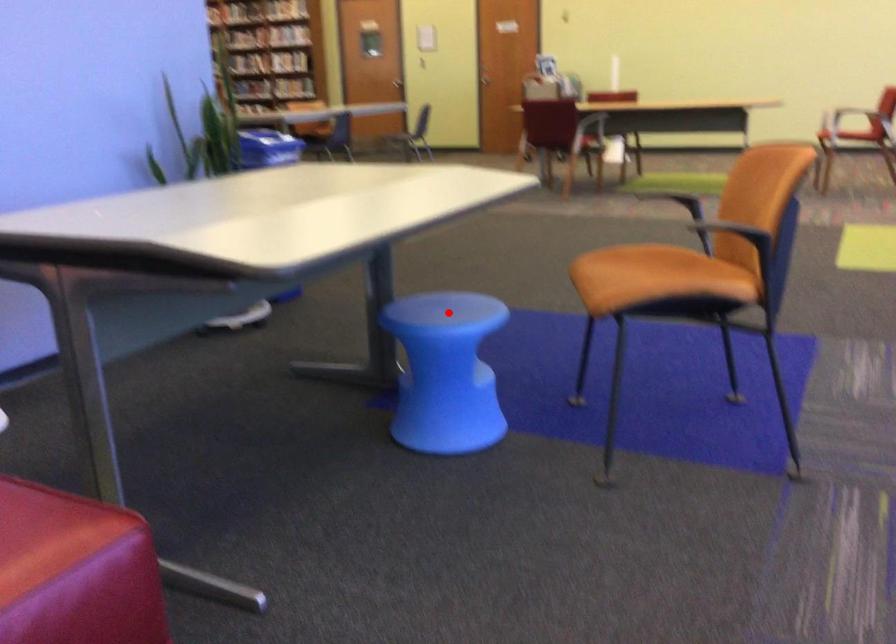
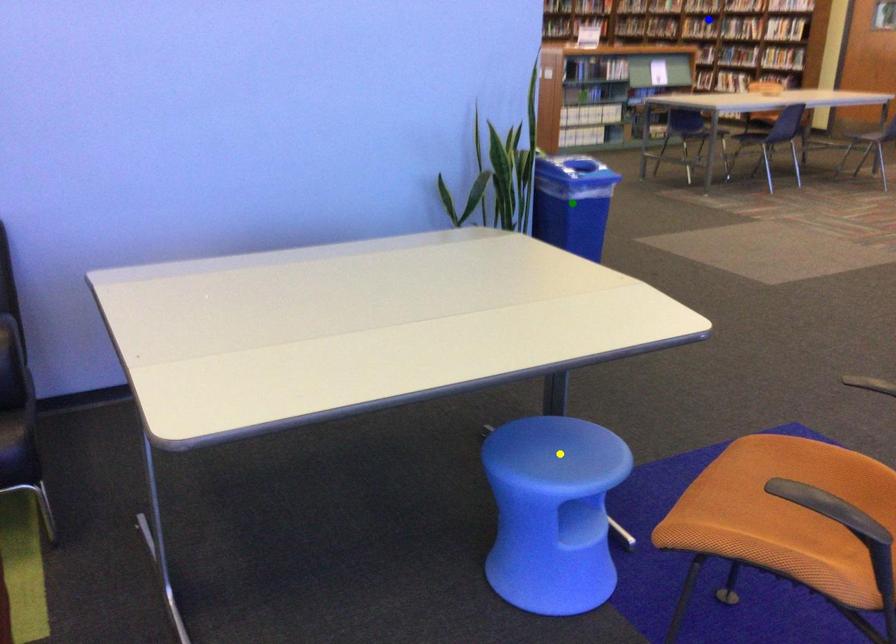
Question: I am providing you with two images of the same scene from different viewpoints. A red point is marked on the first image. You are given multiple points on the second image. Which point in image 2 is actually the same real-world point as the red point in image 1?

Choices:
 (A) blue point
 (B) green point
 (C) yellow point

Answer: (C)